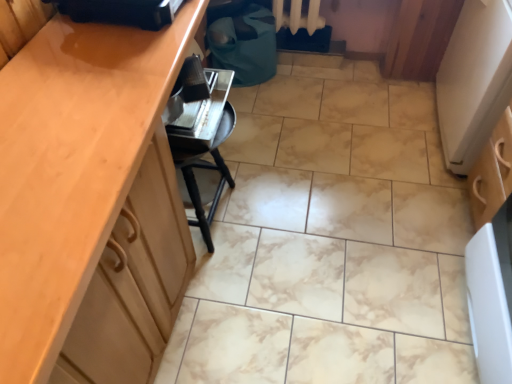
Question: Visually, is white textured radiator at upper center positioned to the left or to the right of matte wood cabinet at left?

Choices:
 (A) right
 (B) left

Answer: (A)

Question: Choose the correct answer: Is white textured radiator at upper center inside matte wood cabinet at left or outside it?

Choices:
 (A) inside
 (B) outside

Answer: (B)

Question: Estimate the real-world distances between objects in this image. Which object is closer to the metallic silver toaster at lower center, the 2th appliance when ordered from front to back?

Choices:
 (A) black plastic bag at upper center, acting as the second appliance starting from the back
 (B) matte wood cabinet at left
 (C) white textured radiator at upper center

Answer: (A)

Question: Which is nearer to the white textured radiator at upper center?

Choices:
 (A) metallic silver toaster at lower center, the first appliance viewed from the back
 (B) black plastic bag at upper center, acting as the second appliance starting from the back
 (C) matte wood cabinet at left

Answer: (A)